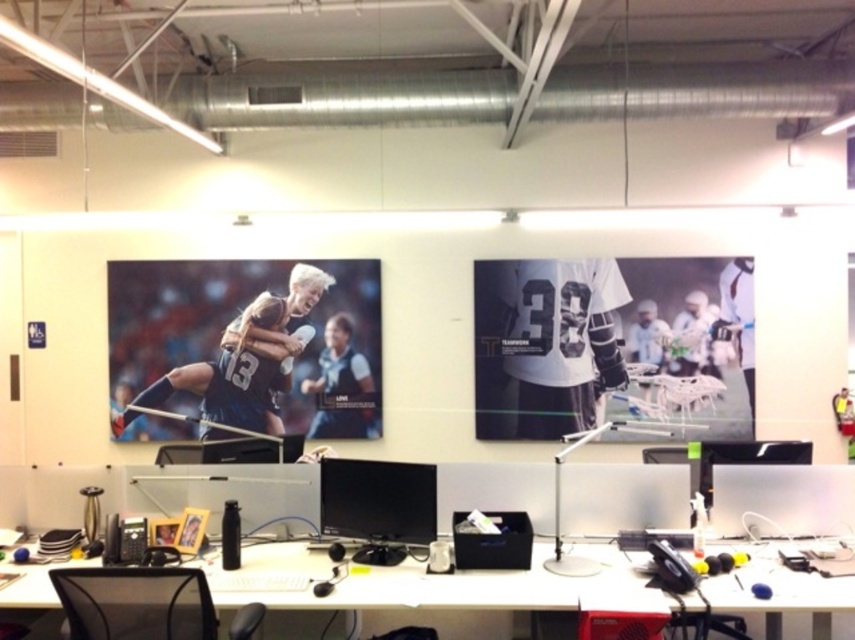
What do you see at coordinates (378, 506) in the screenshot?
I see `black glossy monitor at center` at bounding box center [378, 506].

In the scene shown: Is black glossy monitor at center to the right of matte black monitor at center from the viewer's perspective?

Incorrect, black glossy monitor at center is not on the right side of matte black monitor at center.

Measure the distance between point (335, 476) and camera.

Point (335, 476) is 3.48 meters away from camera.

Find the location of a particular element. This screenshot has height=640, width=855. black glossy monitor at center is located at coordinates (378, 506).

From the picture: Between black glossy monitor at center and transparent plastic monitor at center, which one has less height?

transparent plastic monitor at center

I want to click on black glossy monitor at center, so click(378, 506).

Who is taller, white plastic computer desk at center or matte black monitor at center?

Standing taller between the two is matte black monitor at center.

Locate an element on the screen. This screenshot has height=640, width=855. white plastic computer desk at center is located at coordinates (447, 586).

Which is in front, point (317, 564) or point (588, 492)?

Point (317, 564)

Where is `white plastic computer desk at center`? Image resolution: width=855 pixels, height=640 pixels. white plastic computer desk at center is located at coordinates (447, 586).